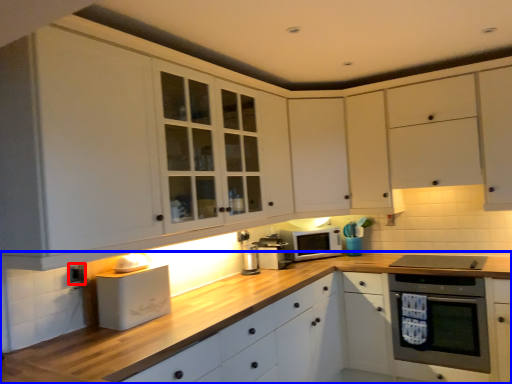
Question: Which object appears farthest to the camera in this image, electric outlet (highlighted by a red box) or countertop (highlighted by a blue box)?

Choices:
 (A) electric outlet
 (B) countertop

Answer: (A)